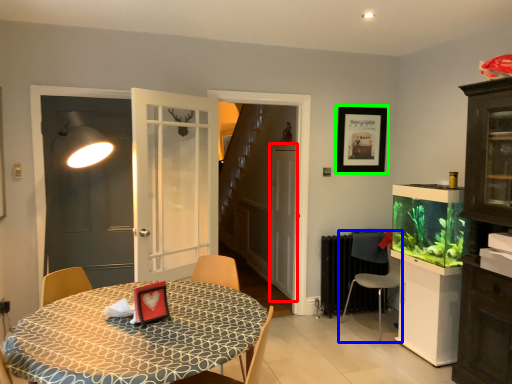
Question: Which object is positioned farthest from screen door (highlighted by a red box)? Select from chair (highlighted by a blue box) and picture frame (highlighted by a green box).

Choices:
 (A) chair
 (B) picture frame

Answer: (A)